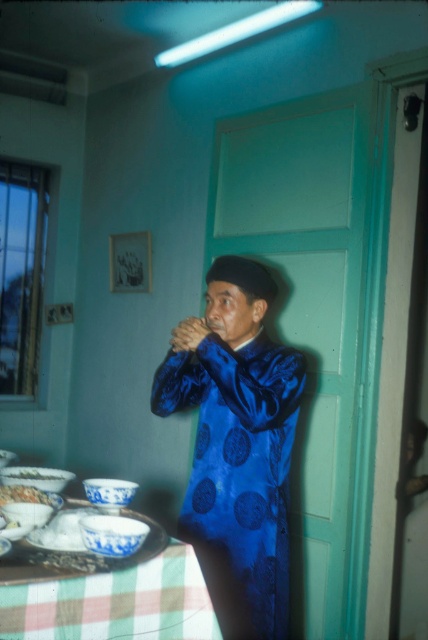
Identify the location of shiny blue robe at center. The width and height of the screenshot is (428, 640). (237, 429).

Is shiny blue robe at center smaller than checkered fabric tablecloth at lower left?

Actually, shiny blue robe at center might be larger than checkered fabric tablecloth at lower left.

Image resolution: width=428 pixels, height=640 pixels. Describe the element at coordinates (237, 429) in the screenshot. I see `shiny blue robe at center` at that location.

At what (x,y) coordinates should I click in order to perform the action: click on shiny blue robe at center. Please return your answer as a coordinate pair (x, y). Looking at the image, I should click on (237, 429).

Which is in front, point (27, 634) or point (0, 500)?

Point (27, 634)

Which is below, checkered fabric tablecloth at lower left or white porcelain bowl at lower left?

Positioned lower is checkered fabric tablecloth at lower left.

Does point (95, 618) lie in front of point (5, 486)?

That is True.

This screenshot has height=640, width=428. I want to click on checkered fabric tablecloth at lower left, so click(x=115, y=604).

Who is more forward, (204,467) or (20,468)?

Point (20,468)

Does shiny blue robe at center have a larger size compared to white glossy bowl at lower left?

Yes.

Who is more distant from viewer, (x=207, y=440) or (x=68, y=472)?

Point (x=68, y=472)

The height and width of the screenshot is (640, 428). I want to click on shiny blue robe at center, so click(x=237, y=429).